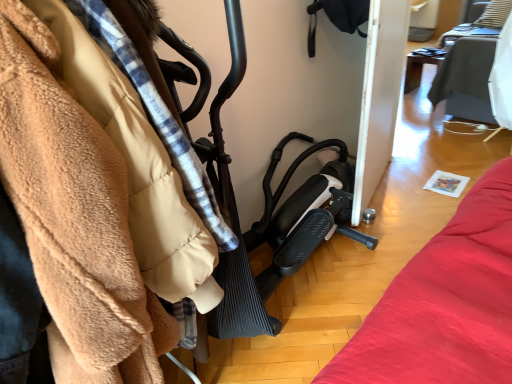
Question: Is wooden table at upper right inside or outside of black rubber baby carriage at center?

Choices:
 (A) outside
 (B) inside

Answer: (A)

Question: In the image, is wooden table at upper right on the left side or the right side of black rubber baby carriage at center?

Choices:
 (A) right
 (B) left

Answer: (A)

Question: Is wooden table at upper right in front of or behind black rubber baby carriage at center in the image?

Choices:
 (A) behind
 (B) front

Answer: (A)

Question: Considering the positions of black rubber baby carriage at center and wooden table at upper right in the image, is black rubber baby carriage at center wider or thinner than wooden table at upper right?

Choices:
 (A) thin
 (B) wide

Answer: (B)

Question: Is black rubber baby carriage at center bigger or smaller than wooden table at upper right?

Choices:
 (A) big
 (B) small

Answer: (A)

Question: Choose the correct answer: Is black rubber baby carriage at center inside wooden table at upper right or outside it?

Choices:
 (A) inside
 (B) outside

Answer: (B)

Question: Is point (259, 334) positioned closer to the camera than point (414, 84)?

Choices:
 (A) farther
 (B) closer

Answer: (B)